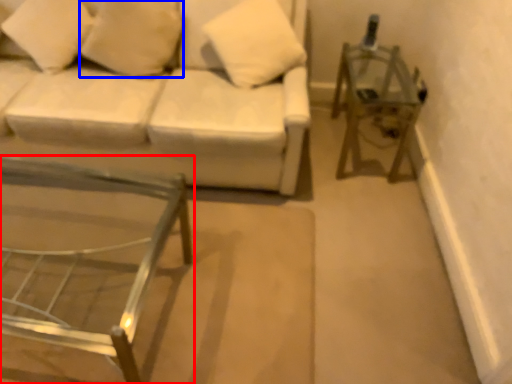
Question: Among these objects, which one is nearest to the camera, table (highlighted by a red box) or pillow (highlighted by a blue box)?

Choices:
 (A) table
 (B) pillow

Answer: (A)